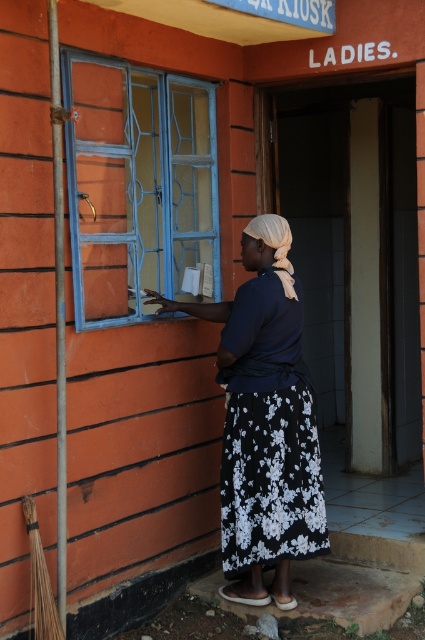
Which is more to the right, black floral skirt at center or black floral fabric dress at center?

black floral fabric dress at center is more to the right.

Consider the image. Does black floral skirt at center appear under black floral fabric dress at center?

Actually, black floral skirt at center is above black floral fabric dress at center.

Describe the element at coordinates (265, 420) in the screenshot. I see `black floral skirt at center` at that location.

Where is `black floral skirt at center`? The height and width of the screenshot is (640, 425). black floral skirt at center is located at coordinates (265, 420).

Between blue painted glass window at left and black floral skirt at center, which one is positioned lower?

black floral skirt at center is lower down.

Between blue painted glass window at left and black floral skirt at center, which one has less height?

With less height is blue painted glass window at left.

The width and height of the screenshot is (425, 640). What are the coordinates of `blue painted glass window at left` in the screenshot? It's located at (138, 186).

Can you confirm if blue painted glass window at left is positioned below black floral fabric dress at center?

Actually, blue painted glass window at left is above black floral fabric dress at center.

Does blue painted glass window at left have a lesser width compared to black floral fabric dress at center?

No.

Between point (96, 120) and point (294, 525), which one is positioned in front?

Point (96, 120) is in front.

The width and height of the screenshot is (425, 640). I want to click on blue painted glass window at left, so click(138, 186).